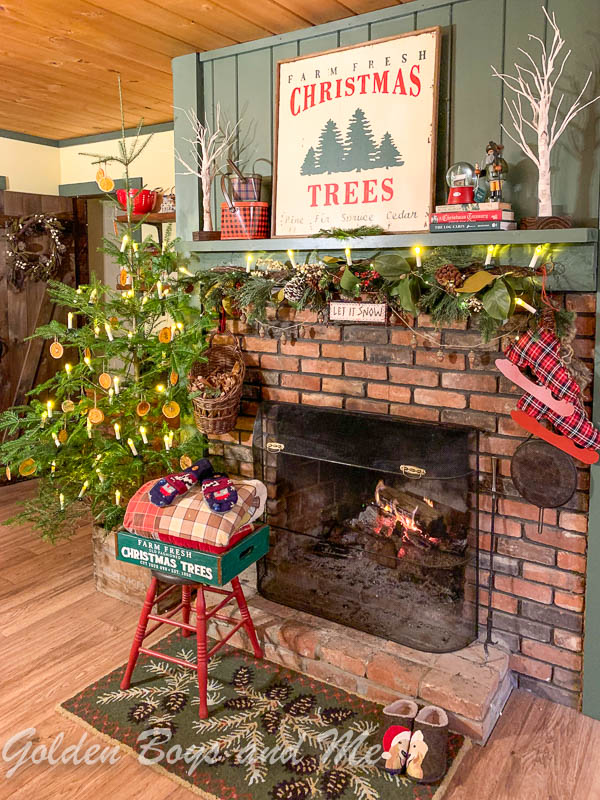
In order to click on silver stool seat in this screenshot , I will do `click(173, 578)`.